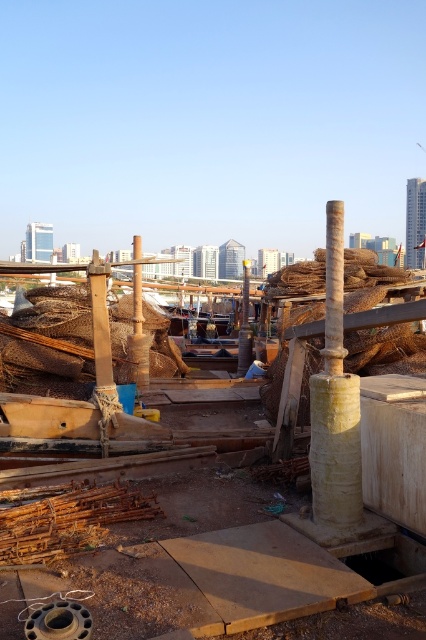
Question: Which of the following is the closest to the observer?

Choices:
 (A) (242, 355)
 (B) (28, 317)
 (C) (247, 532)

Answer: (C)

Question: Which point is farther from the camera taking this photo?

Choices:
 (A) (244, 307)
 (B) (92, 339)

Answer: (A)

Question: Can you confirm if brown woven netting at center is positioned below yellowish concrete pole at center-right?

Choices:
 (A) no
 (B) yes

Answer: (B)

Question: Can you confirm if rusty metal rods at lower left is positioned above matte brown pole at center?

Choices:
 (A) no
 (B) yes

Answer: (A)

Question: Which point is closer to the camera?

Choices:
 (A) rusty wire mesh at center
 (B) matte brown pole at center
 (C) brown woven netting at center

Answer: (C)

Question: Can you confirm if brown woven netting at center is positioned below rusty metal rods at lower left?

Choices:
 (A) no
 (B) yes

Answer: (A)